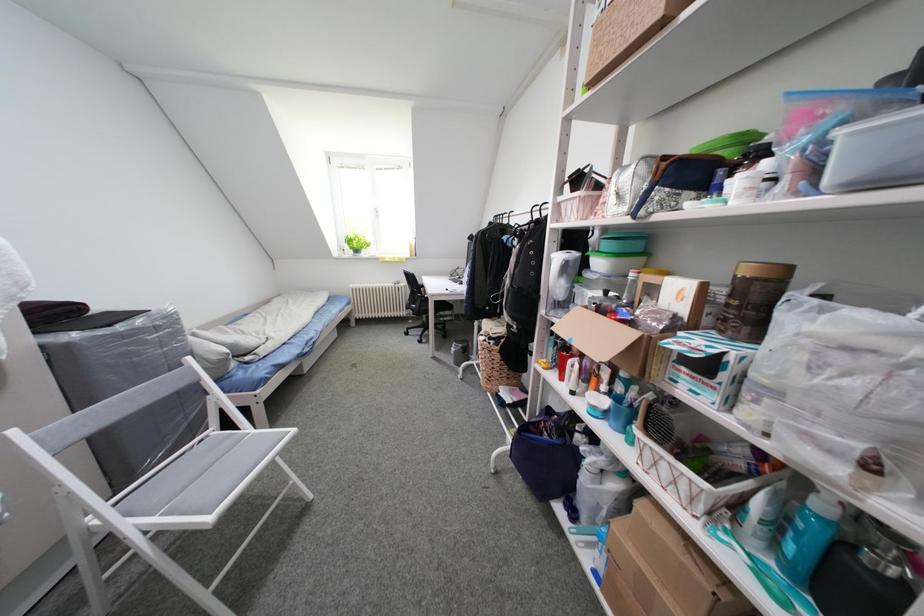
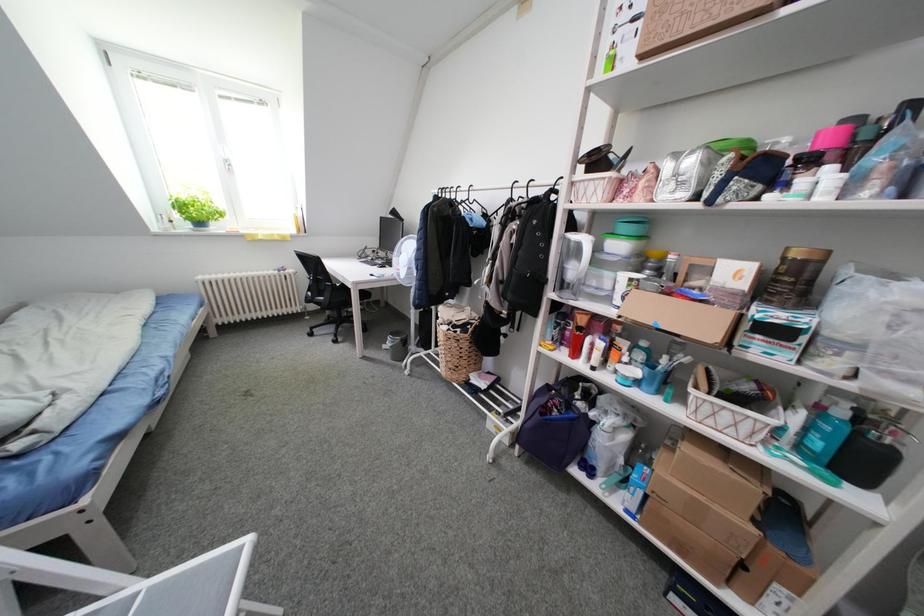
Which direction would the cameraman need to move to produce the second image?

The movement direction of the cameraman is left, forward.